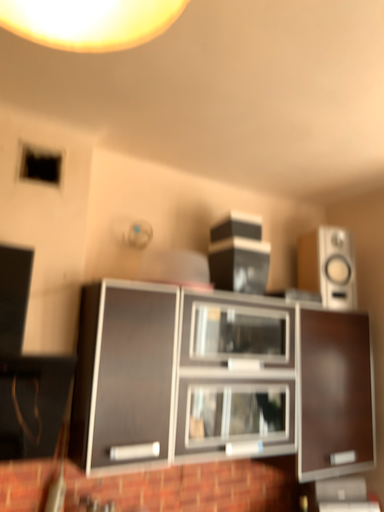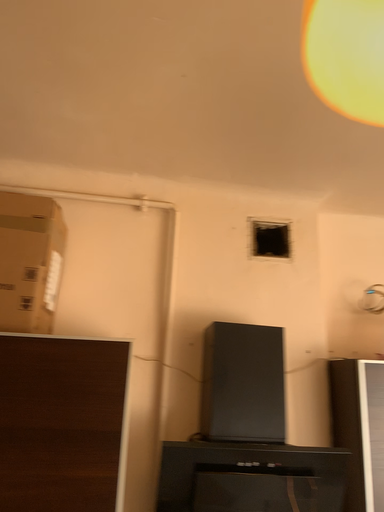
Question: Which way did the camera rotate in the video?

Choices:
 (A) rotated right
 (B) rotated left

Answer: (B)